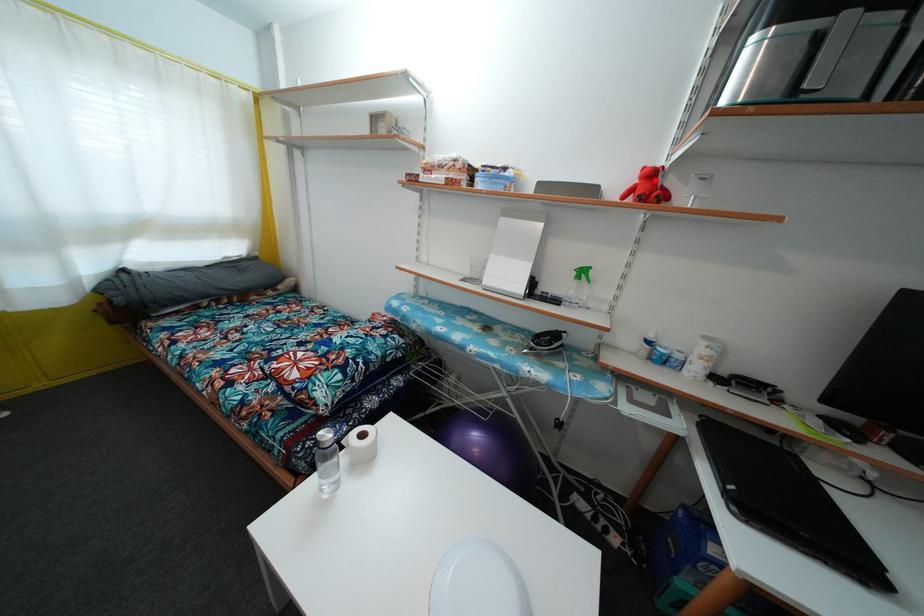
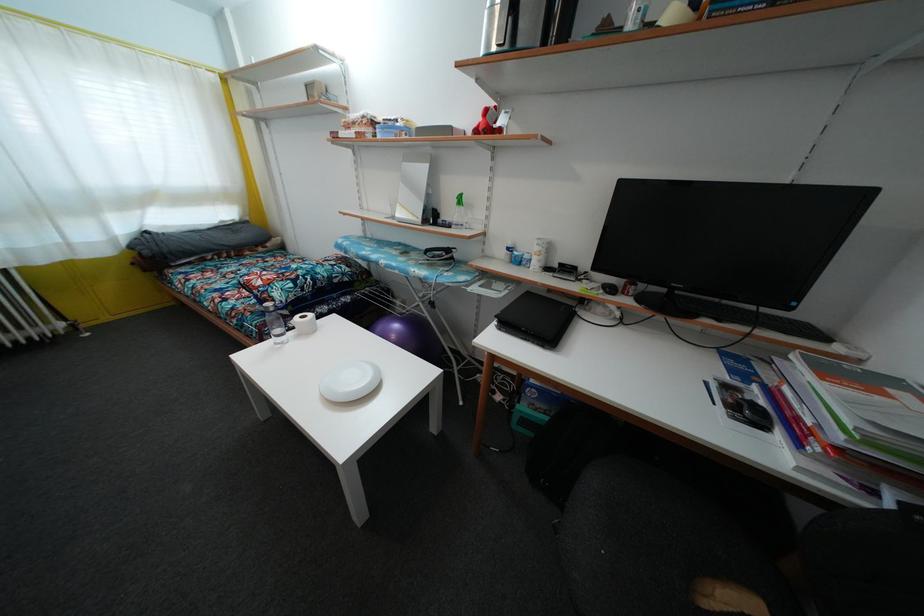
Locate, in the second image, the point that corresponds to the highlighted location in the first image.

(490, 119)